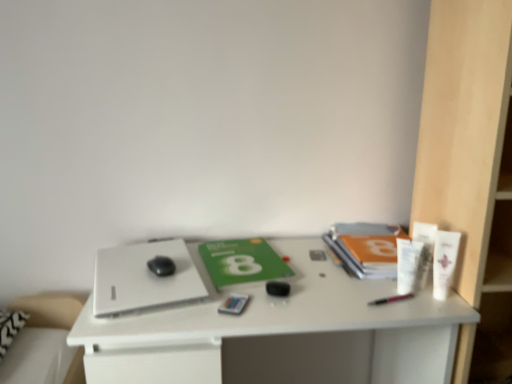
Locate an element on the screen. The height and width of the screenshot is (384, 512). free space that is to the left of matte plastic card at center, which appears as the first stationery when viewed from the left is located at coordinates (170, 318).